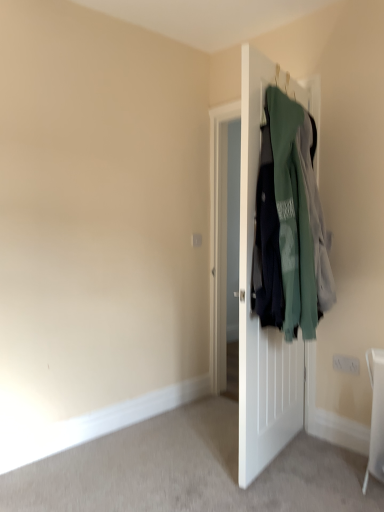
Question: Based on their sizes in the image, would you say green fabric jackets at right is bigger or smaller than white matte door at center?

Choices:
 (A) small
 (B) big

Answer: (B)

Question: From a real-world perspective, is green fabric jackets at right above or below white matte door at center?

Choices:
 (A) above
 (B) below

Answer: (A)

Question: Considering the positions of point (266, 129) and point (248, 283), is point (266, 129) closer or farther from the camera than point (248, 283)?

Choices:
 (A) farther
 (B) closer

Answer: (B)

Question: Is white matte door at center in front of or behind green fabric jackets at right in the image?

Choices:
 (A) front
 (B) behind

Answer: (B)

Question: Is white matte door at center wider or thinner than green fabric jackets at right?

Choices:
 (A) wide
 (B) thin

Answer: (B)

Question: Is point coord(253,429) positioned closer to the camera than point coord(274,134)?

Choices:
 (A) closer
 (B) farther

Answer: (B)

Question: Based on their positions, is white matte door at center located to the left or right of green fabric jackets at right?

Choices:
 (A) right
 (B) left

Answer: (B)